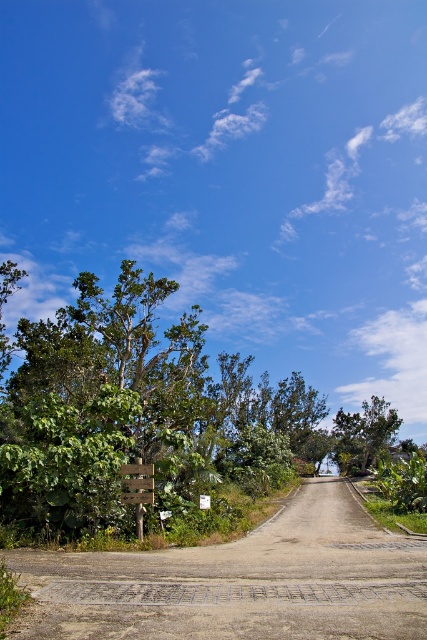
Question: Where is green leafy tree at left located in relation to brown gravel road at center in the image?

Choices:
 (A) right
 (B) left

Answer: (B)

Question: Does brown gravel road at center have a smaller size compared to green leafy tree at center?

Choices:
 (A) yes
 (B) no

Answer: (A)

Question: Is green leafy tree at left positioned at the back of brown gravel road at center?

Choices:
 (A) yes
 (B) no

Answer: (A)

Question: Which of the following is the farthest from the observer?

Choices:
 (A) brown gravel road at center
 (B) green leafy tree at center
 (C) green leafy tree at left

Answer: (B)

Question: Which object appears farthest from the camera in this image?

Choices:
 (A) wooden sign at center
 (B) green leafy tree at left

Answer: (A)

Question: Which point is closer to the camera?

Choices:
 (A) wooden sign at center
 (B) green leafy tree at center

Answer: (A)